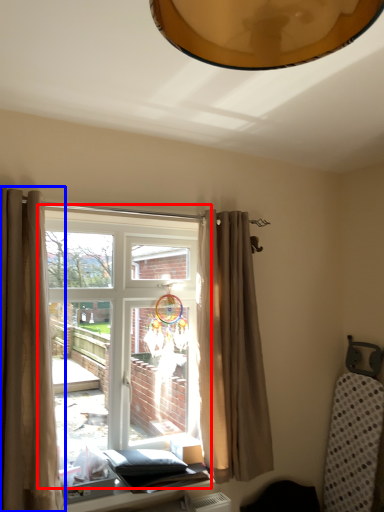
Question: Which object appears farthest to the camera in this image, window (highlighted by a red box) or curtain (highlighted by a blue box)?

Choices:
 (A) window
 (B) curtain

Answer: (A)